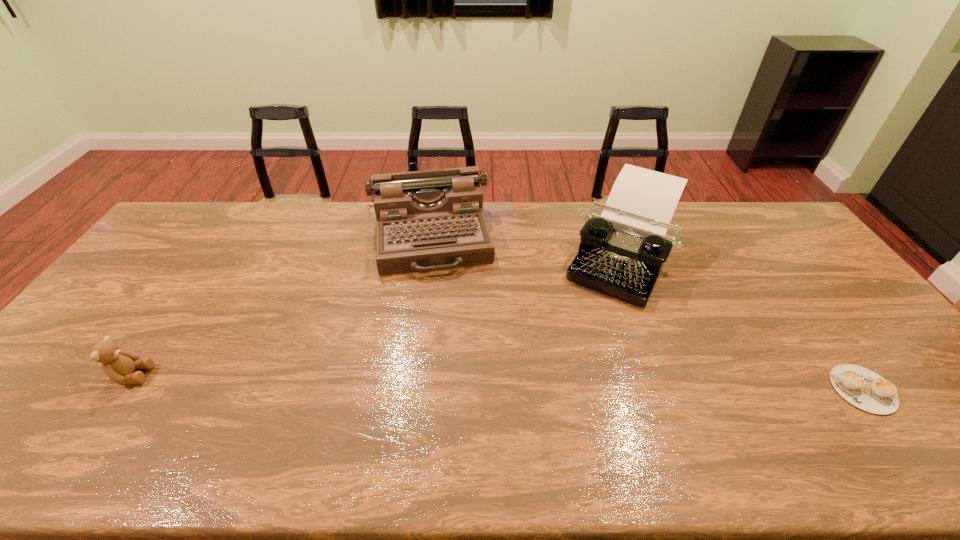
Find the location of a particular element. The width and height of the screenshot is (960, 540). teddy bear is located at coordinates (118, 365).

Identify the location of the second shortest object. (118, 365).

Where is `the shortest object`? The height and width of the screenshot is (540, 960). the shortest object is located at coordinates (863, 388).

At what (x,y) coordinates should I click in order to perform the action: click on the rightmost object. Please return your answer as a coordinate pair (x, y). The image size is (960, 540). Looking at the image, I should click on (863, 388).

Find the location of a particular element. the third object from left to right is located at coordinates (622, 251).

You are a GUI agent. You are given a task and a screenshot of the screen. Output one action in this format:
    pyautogui.click(x=<x>, y=<y>)
    Task: Click on the second object from left to right
    Image resolution: width=960 pixels, height=540 pixels.
    Given the screenshot: What is the action you would take?
    pyautogui.click(x=429, y=220)

Image resolution: width=960 pixels, height=540 pixels. Identify the location of vacant space located on the face of the third tallest object. (209, 375).

Locate an element on the screen. free spot located 0.330m on the back of the cappuccino is located at coordinates (781, 278).

In order to click on vacant space positioned on the keys of the right typewriter in this screenshot , I will do `click(583, 339)`.

Locate an element on the screen. This screenshot has width=960, height=540. vacant area situated 0.150m on the keys of the right typewriter is located at coordinates (586, 334).